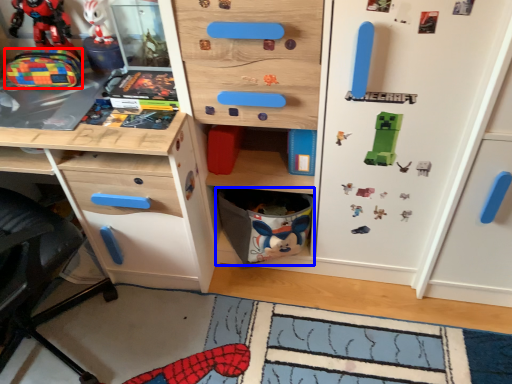
Question: Among these objects, which one is farthest to the camera, toy (highlighted by a red box) or cabinet (highlighted by a blue box)?

Choices:
 (A) toy
 (B) cabinet

Answer: (B)